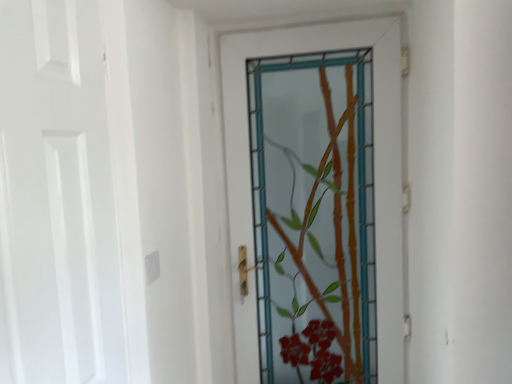
Question: Would you say translucent glass bamboo at center, acting as the 2th door starting from the front, is to the left or to the right of white matte door at left, which is the first door in front-to-back order, in the picture?

Choices:
 (A) left
 (B) right

Answer: (B)

Question: From a real-world perspective, is translucent glass bamboo at center, which appears as the 1th door when viewed from the back, above or below white matte door at left, which is the first door in front-to-back order?

Choices:
 (A) below
 (B) above

Answer: (A)

Question: From the image's perspective, relative to white matte door at left, the 1th door viewed from the left, is translucent glass bamboo at center, which appears as the 1th door when viewed from the back, above or below?

Choices:
 (A) below
 (B) above

Answer: (A)

Question: Is white matte door at left, which is the first door in front-to-back order, inside the boundaries of translucent glass bamboo at center, placed as the 1th door when sorted from right to left, or outside?

Choices:
 (A) inside
 (B) outside

Answer: (B)

Question: Is point (19, 336) positioned closer to the camera than point (263, 54)?

Choices:
 (A) farther
 (B) closer

Answer: (B)

Question: From the image's perspective, relative to translucent glass bamboo at center, acting as the 2th door starting from the front, is white matte door at left, which is the first door in front-to-back order, above or below?

Choices:
 (A) above
 (B) below

Answer: (A)

Question: In terms of size, does white matte door at left, the 1th door viewed from the left, appear bigger or smaller than translucent glass bamboo at center, the second door positioned from the left?

Choices:
 (A) big
 (B) small

Answer: (B)